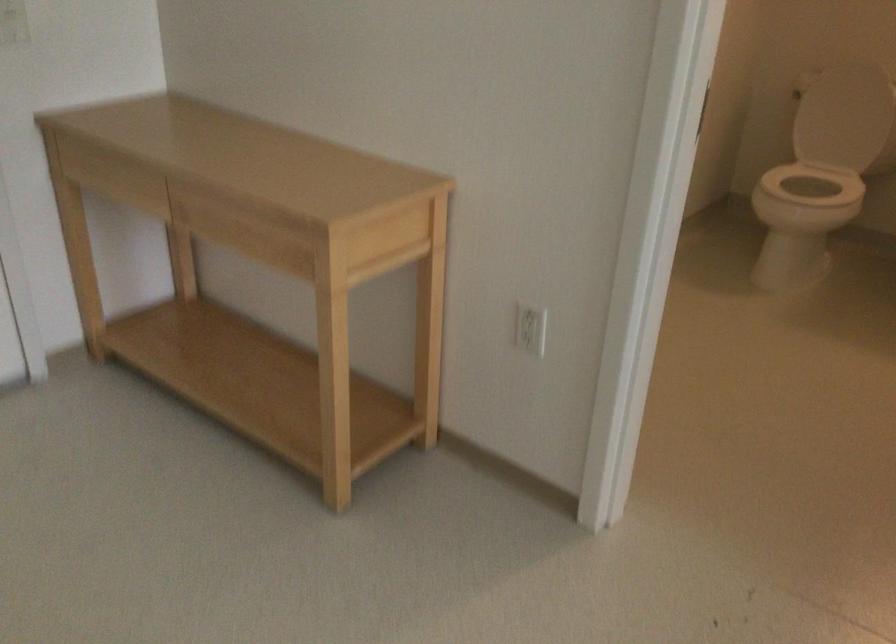
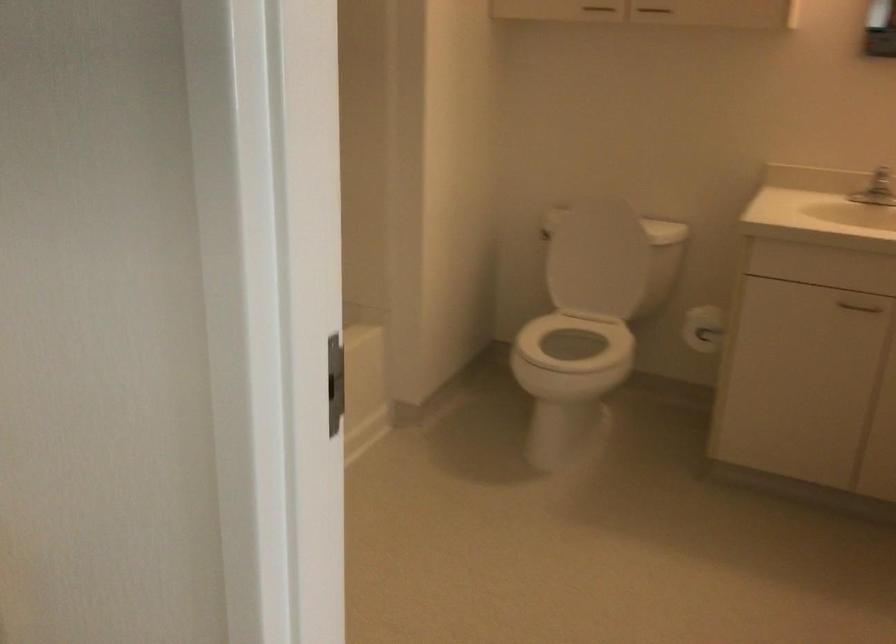
Question: Based on the continuous images, in which direction is the camera rotating? Reply with the corresponding letter.

Choices:
 (A) Left
 (B) Right
 (C) Up
 (D) Down

Answer: (B)